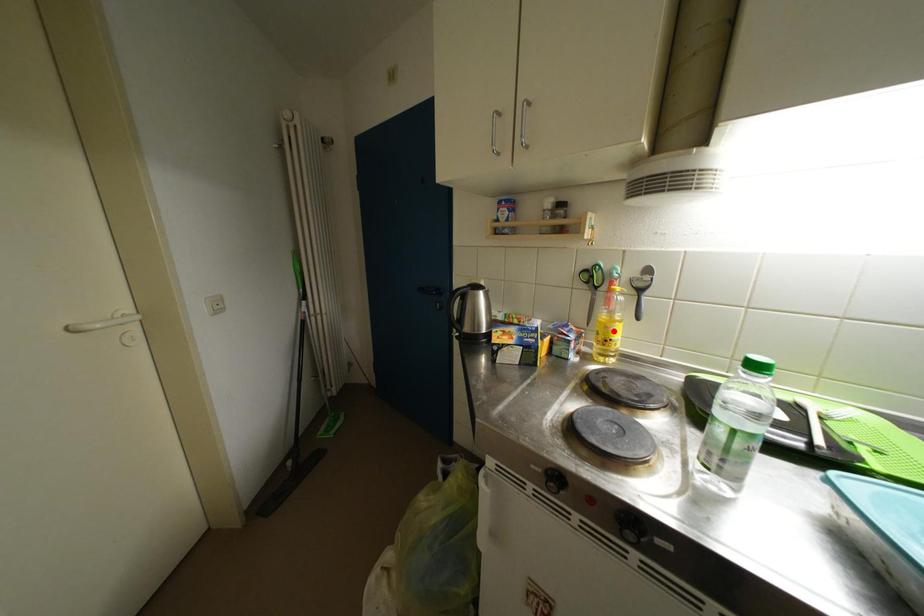
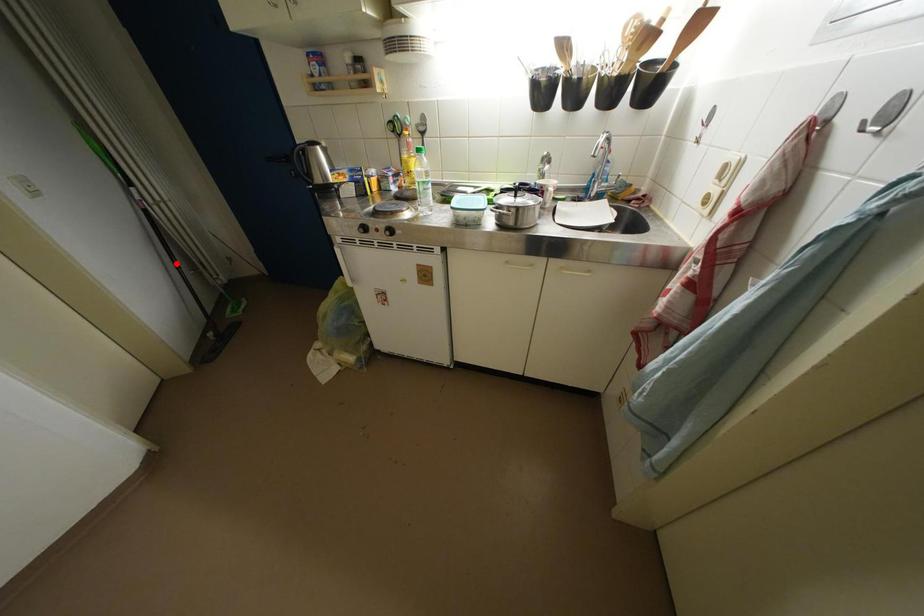
I am providing you with two images of the same scene from different viewpoints. A red point is marked on the first image and another point is marked on the second image. Is the marked point in image1 the same physical position as the marked point in image2?

No